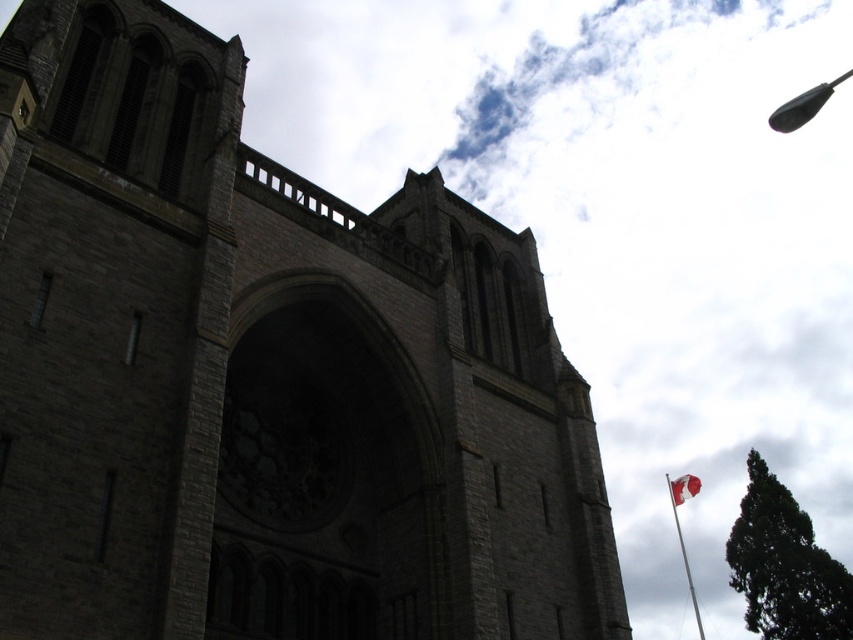
Question: Which is farther from the black plastic antenna at upper right?

Choices:
 (A) white fabric flag at lower right
 (B) dark gray stone church at center

Answer: (A)

Question: Which is nearer to the dark gray stone church at center?

Choices:
 (A) white fabric flag at lower right
 (B) metallic flagpole at upper right
 (C) black plastic antenna at upper right

Answer: (C)

Question: Considering the real-world distances, which object is closest to the metallic flagpole at upper right?

Choices:
 (A) black plastic antenna at upper right
 (B) dark gray stone church at center

Answer: (A)

Question: From the image, what is the correct spatial relationship of dark gray stone church at center in relation to white fabric flag at lower right?

Choices:
 (A) right
 (B) left

Answer: (B)

Question: Is black plastic antenna at upper right bigger than metallic flagpole at upper right?

Choices:
 (A) no
 (B) yes

Answer: (B)

Question: Can you confirm if dark gray stone church at center is positioned below black plastic antenna at upper right?

Choices:
 (A) yes
 (B) no

Answer: (A)